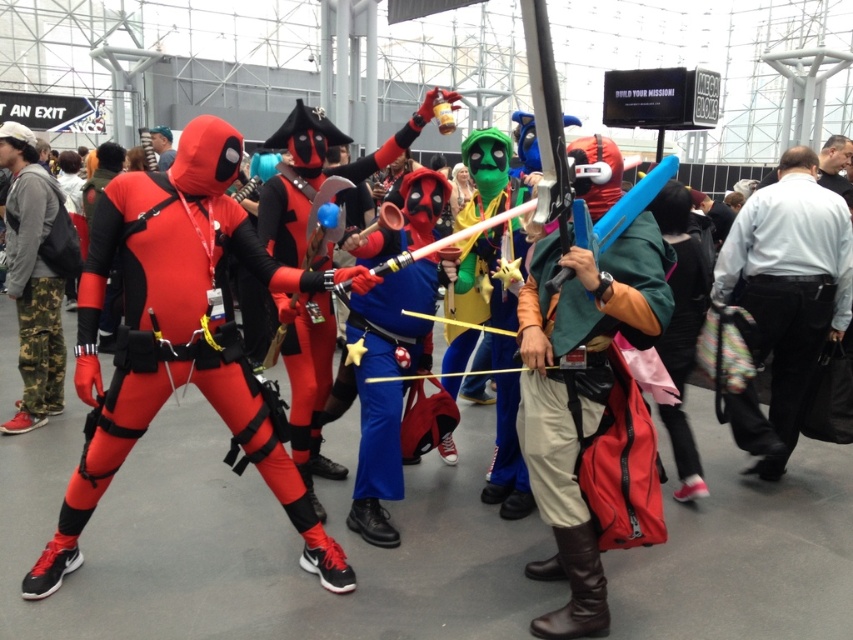
You are a photographer at the event and need to capture both the matte spandex suit at center and the camo pants at left in a single photo. Which object should you focus on first to ensure both are in frame?

The matte spandex suit at center is shorter than the camo pants at left, so focusing on the camo pants at left first will help ensure both are captured in the photo.

From the picture: You are standing in the convention center and see two points marked in the image. Which point, point (x=213, y=397) or point (x=20, y=227), is closer to you?

Point (x=213, y=397) is closer to the viewer than point (x=20, y=227).